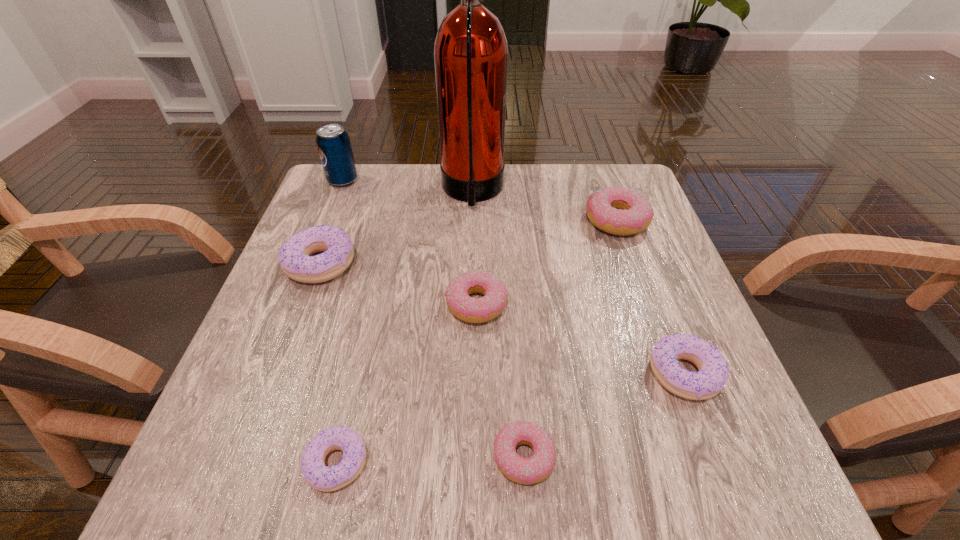
In the image, there is a desktop. At what (x,y) coordinates should I click in order to perform the action: click on blank space at the left edge. Please return your answer as a coordinate pair (x, y). The height and width of the screenshot is (540, 960). Looking at the image, I should click on (266, 384).

Identify the location of vacant position at the right edge of the desktop. (641, 320).

Locate an element on the screen. This screenshot has width=960, height=540. free region at the far left corner of the desktop is located at coordinates (386, 176).

In the image, there is a desktop. In order to click on free space at the far right corner in this screenshot , I will do `click(596, 179)`.

Where is `free space between the soda can and the leftmost doughnut`? Image resolution: width=960 pixels, height=540 pixels. free space between the soda can and the leftmost doughnut is located at coordinates point(332,222).

The image size is (960, 540). What are the coordinates of `free spot between the second doughnut from left to right and the second tallest object` in the screenshot? It's located at (340, 322).

At what (x,y) coordinates should I click in order to perform the action: click on free point between the tallest object and the nearest purple doughnut. Please return your answer as a coordinate pair (x, y). Looking at the image, I should click on (405, 327).

Where is `blank region between the second farthest pink doughnut and the farthest purple doughnut`? The height and width of the screenshot is (540, 960). blank region between the second farthest pink doughnut and the farthest purple doughnut is located at coordinates pos(398,284).

Image resolution: width=960 pixels, height=540 pixels. Identify the location of free space that is in between the soda can and the second smallest purple doughnut. (514, 277).

Where is `vacant area between the rightmost pink doughnut and the leftmost doughnut`? This screenshot has height=540, width=960. vacant area between the rightmost pink doughnut and the leftmost doughnut is located at coordinates (468, 242).